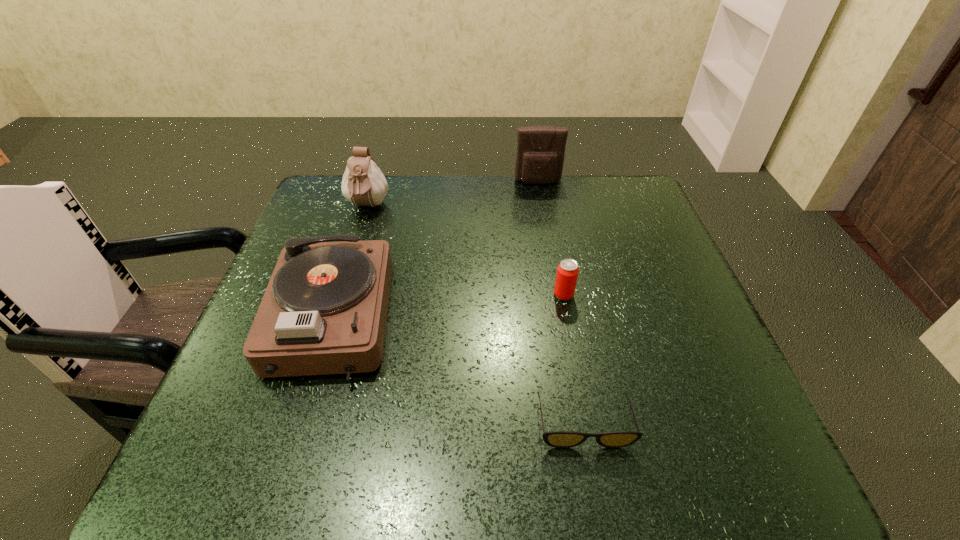
You are a GUI agent. You are given a task and a screenshot of the screen. Output one action in this format:
    pyautogui.click(x=<x>, y=<y>)
    Task: Click on the vacant space at the far right corner
    
    Given the screenshot: What is the action you would take?
    [590, 199]

Locate an element on the screen. The width and height of the screenshot is (960, 540). free space between the sunglasses and the right pouch is located at coordinates (561, 302).

Where is `vacant point located between the third shortest object and the nearest object`? Image resolution: width=960 pixels, height=540 pixels. vacant point located between the third shortest object and the nearest object is located at coordinates (458, 370).

Identify the location of unoccupied area between the fourth nearest object and the beer can. (466, 251).

Locate an element on the screen. empty space that is in between the fourth nearest object and the beer can is located at coordinates (466, 251).

Identify the location of free space that is in between the left pouch and the farthest object. (453, 194).

This screenshot has height=540, width=960. Find the location of `free area in between the beer can and the farther pouch`. free area in between the beer can and the farther pouch is located at coordinates (551, 239).

Locate an element on the screen. empty space that is in between the shortest object and the fourth tallest object is located at coordinates (574, 359).

Find the location of `vacant space that's between the nearer pouch and the fourth tallest object`. vacant space that's between the nearer pouch and the fourth tallest object is located at coordinates (466, 251).

Locate an element on the screen. free space between the beer can and the fourth nearest object is located at coordinates coord(466,251).